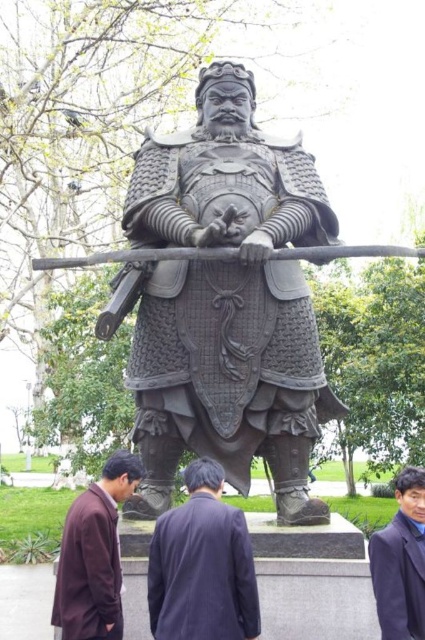
From the picture: You are an artist preparing to sketch the scene. You notice the dark brown fabric coat at center and the dark blue woolen robe at lower right. Which object should you draw first if you want to depict them in the correct size relationship?

You should draw the dark brown fabric coat at center first because it is smaller than the dark blue woolen robe at lower right, so starting with the smaller one allows you to scale up appropriately for the larger robe.

From the picture: You are an art student analyzing the statue of the warrior. You notice two elements at the center of the statue. Which one is closer to you, the black polished armor at center or the dark brown fabric coat at center?

The black polished armor at center is closer to you than the dark brown fabric coat at center.